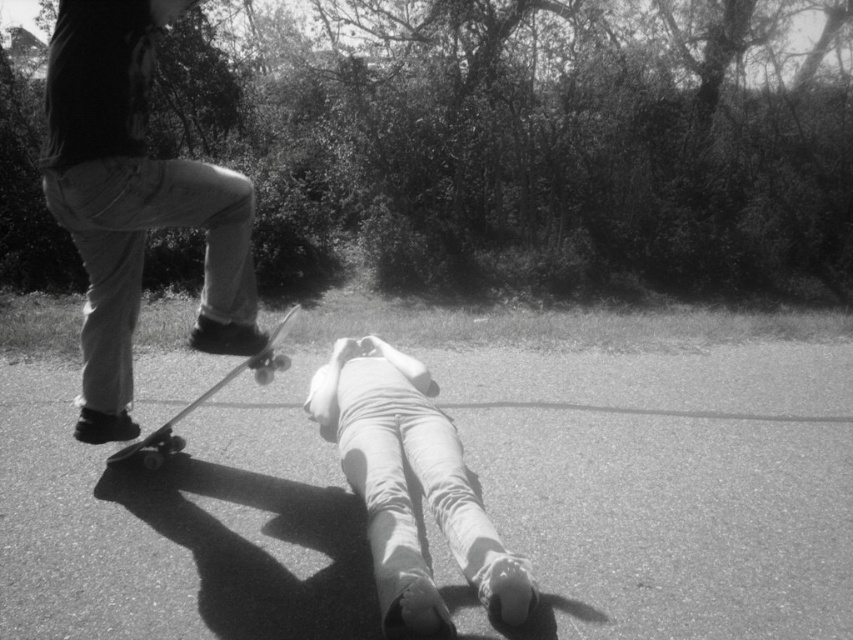
You are a photographer trying to capture the scene. You want to ensure that the denim jeans at center and the smooth wood skateboard at lower left are both visible in your shot. Based on their positions, which object is closer to the camera?

The denim jeans at center is positioned under the smooth wood skateboard at lower left, so the smooth wood skateboard at lower left is closer to the camera.

You are standing in the park and see the dark gray jeans at left. Based on their position, can you determine if they are closer to the person lying on their back or further away?

The dark gray jeans at left is located at point (x=132, y=200), so they are further away from the person lying on their back.